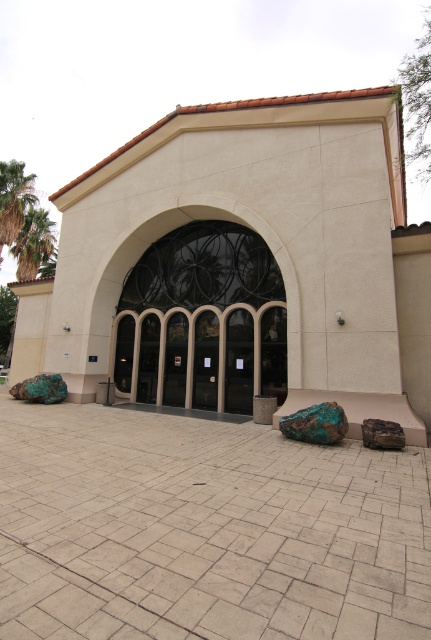
Can you confirm if green leafy palm tree at left is positioned to the left of green rough stone at lower right?

Indeed, green leafy palm tree at left is positioned on the left side of green rough stone at lower right.

Does green leafy palm tree at left appear over green rough stone at lower right?

Correct, green leafy palm tree at left is located above green rough stone at lower right.

What do you see at coordinates (33, 243) in the screenshot? This screenshot has height=640, width=431. I see `green leafy palm tree at left` at bounding box center [33, 243].

Identify the location of green leafy palm tree at left. The image size is (431, 640). (33, 243).

Does beige stone archway at center appear over green rough stone at lower right?

Yes, beige stone archway at center is above green rough stone at lower right.

Who is lower down, beige stone archway at center or green rough stone at lower right?

green rough stone at lower right is lower down.

Who is more distant from viewer, (146, 260) or (365, 433)?

The point (146, 260) is more distant.

Identify the location of beige stone archway at center. (203, 321).

Between point (106, 349) and point (396, 422), which one is positioned behind?

The point (106, 349) is behind.

Does beige stucco chapel at center appear under green rough stone at lower right?

Incorrect, beige stucco chapel at center is not positioned below green rough stone at lower right.

Locate an element on the screen. This screenshot has width=431, height=640. beige stucco chapel at center is located at coordinates (244, 262).

Where is `beige stucco chapel at center`? beige stucco chapel at center is located at coordinates (244, 262).